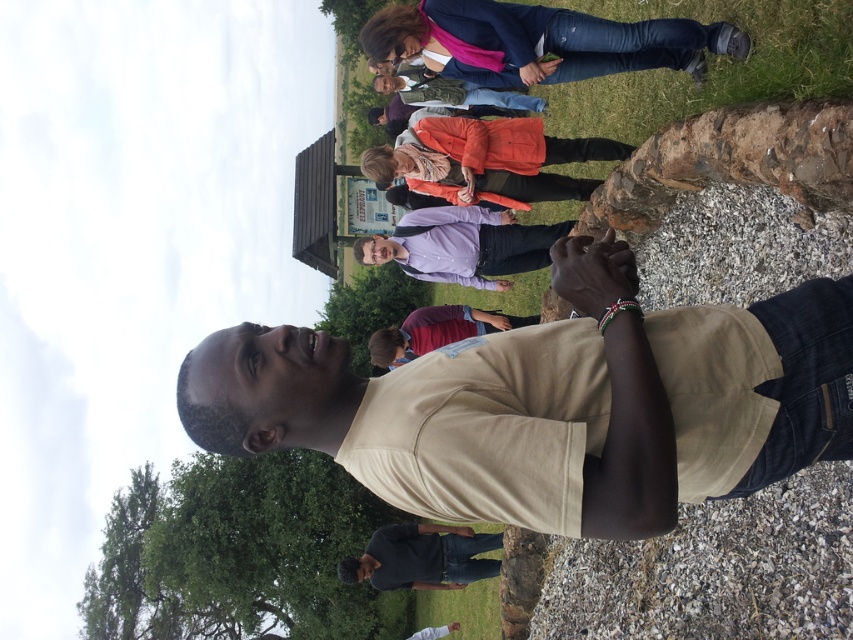
Question: Among these objects, which one is nearest to the camera?

Choices:
 (A) maroon fabric shirt at center
 (B) beige cotton shirt at center

Answer: (B)

Question: Considering the real-world distances, which object is closest to the maroon fabric shirt at center?

Choices:
 (A) dark gray cotton shirt at center
 (B) purple cotton shirt at center
 (C) green leafy tree at lower left
 (D) beige cotton shirt at center

Answer: (B)

Question: Can you confirm if beige cotton shirt at center is smaller than denim jeans at upper right?

Choices:
 (A) yes
 (B) no

Answer: (A)

Question: Does green leafy tree at lower left appear under dark gray cotton shirt at center?

Choices:
 (A) yes
 (B) no

Answer: (A)

Question: Can you confirm if purple cotton shirt at center is positioned to the right of dark gray cotton shirt at center?

Choices:
 (A) yes
 (B) no

Answer: (A)

Question: Which object is closer to the camera taking this photo?

Choices:
 (A) green leafy tree at lower left
 (B) maroon fabric shirt at center
 (C) green leafy tree at center
 (D) beige cotton shirt at center

Answer: (D)